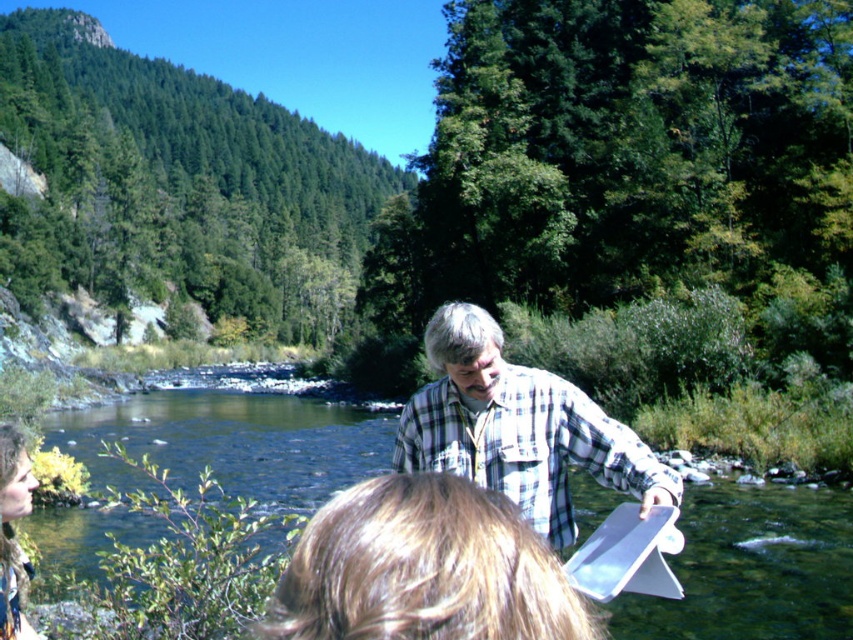
You are standing at the edge of the river and want to take a photo of the clear water at creek center and the plaid cotton shirt at center. Which object will appear bigger in your photo?

The clear water at creek center will appear bigger in the photo because it is larger in size than the plaid cotton shirt at center.

Based on the photo, you are standing at the riverbank and want to hand a document to the person wearing the plaid cotton shirt at center. However, you are currently near the camouflage fabric jacket at lower left. Can you directly hand the document without moving closer? Explain why based on their positions.

The plaid cotton shirt at center is located above camouflage fabric jacket at lower left, meaning the person in the plaid cotton shirt is positioned higher up. Since you are near the camouflage fabric jacket at lower left, you would need to move closer to reach them as they are not in direct line of sight due to the elevation difference.